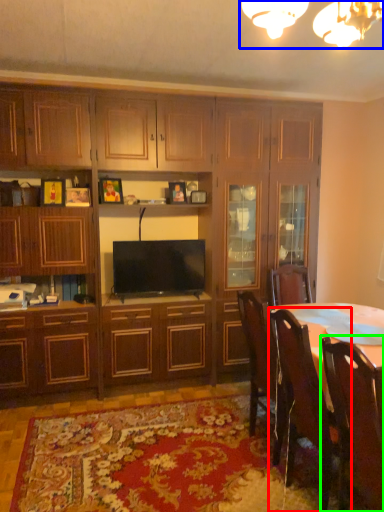
Question: Which is nearer to the chair (highlighted by a red box)? light fixture (highlighted by a blue box) or chair (highlighted by a green box).

Choices:
 (A) light fixture
 (B) chair

Answer: (B)